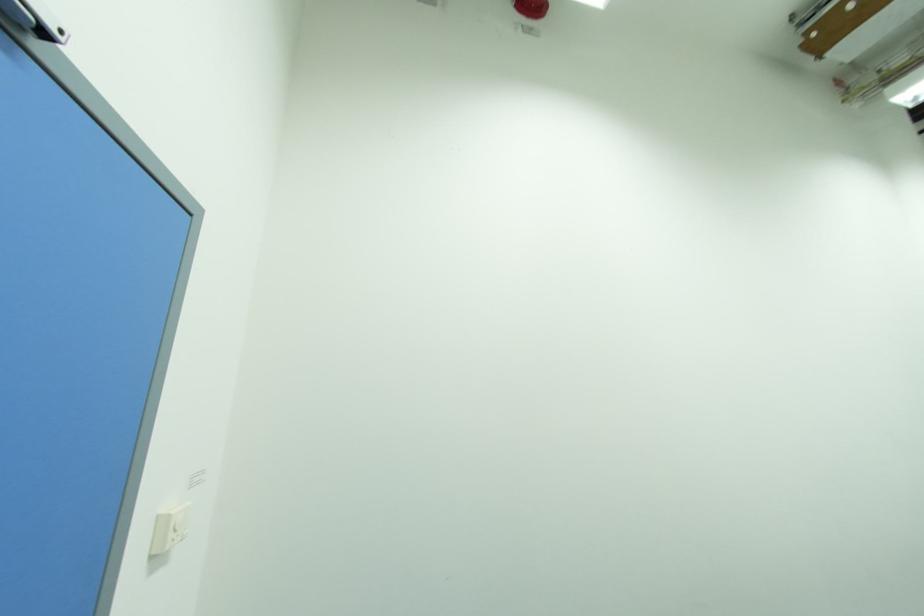
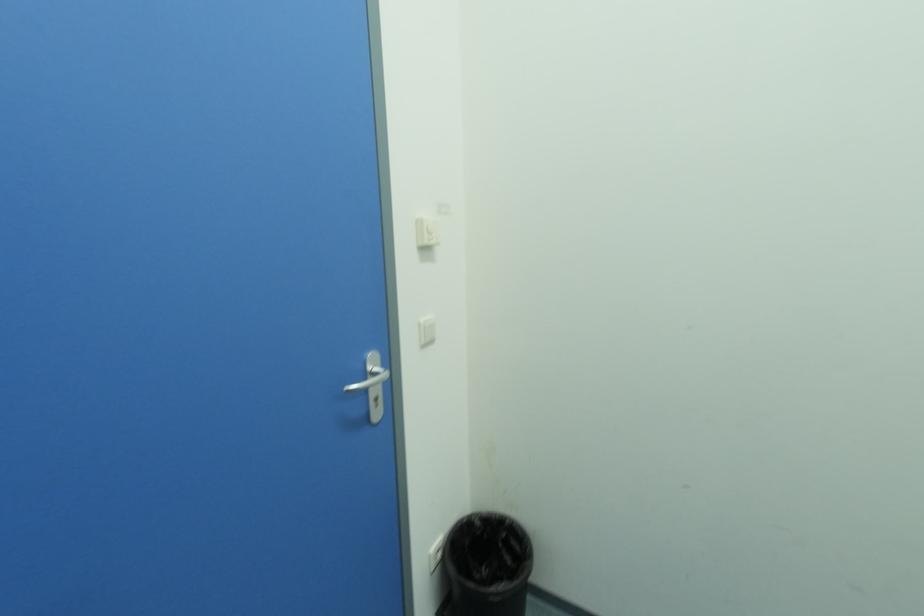
The images are taken continuously from a first-person perspective. In which direction is your viewpoint rotating?

The camera rotated toward left-down.